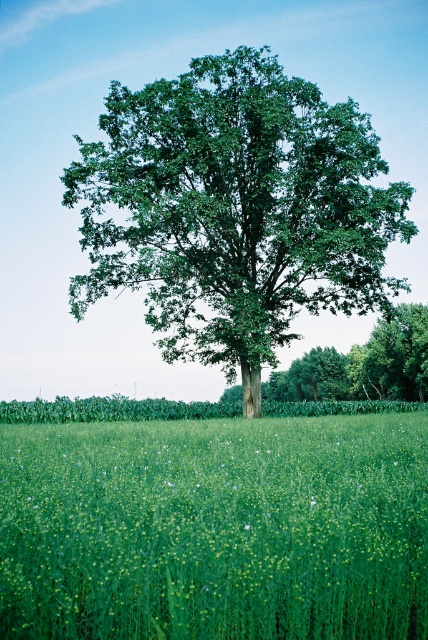
Consider the image. You are standing at the point with coordinates (234,211) in the image. What object is located exactly at your current position?

The green leafy oak tree at center is located exactly at the point with coordinates (234,211).

You are standing in the field and see the green grass at center and the green leafy oak tree at center. Which object is located to the right of the other?

The green grass at center is to the right of the green leafy oak tree at center.